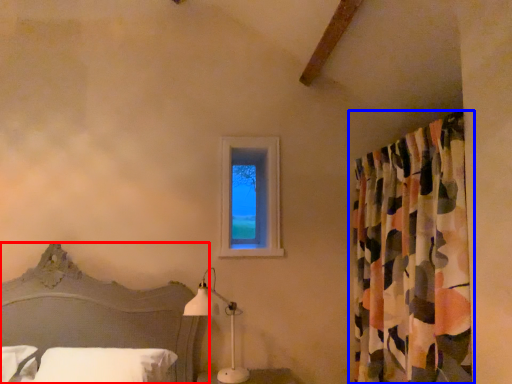
Question: Which object appears farthest to the camera in this image, bed (highlighted by a red box) or curtain (highlighted by a blue box)?

Choices:
 (A) bed
 (B) curtain

Answer: (B)